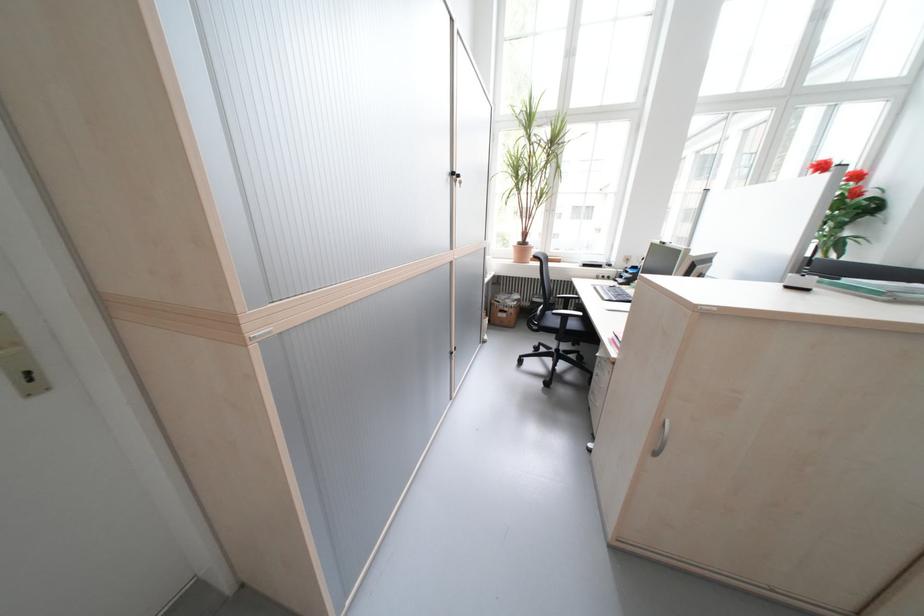
Describe the element at coordinates (569, 322) in the screenshot. I see `the chair sitting surface` at that location.